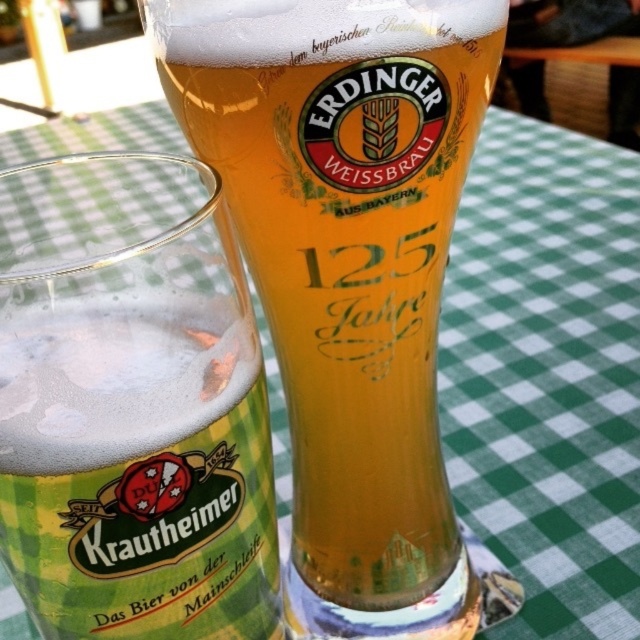
You are at a pub and want to order the larger beer. Which one should you choose between the golden glass beer at center and the translucent glass krautheimer beer at center?

The golden glass beer at center is larger in size than the translucent glass krautheimer beer at center, so you should choose the golden glass beer at center.

You are a bartender who needs to place a coaster under each beer glass to prevent condensation damage. The coasters you have are exactly the same size as the widest part of the translucent glass krautheimer beer at center. Will the coaster fit under the golden glass beer at center?

The golden glass beer at center might be wider than the translucent glass krautheimer beer at center, so the coaster, which is sized for the latter, may not fit properly under the former due to potential width differences.